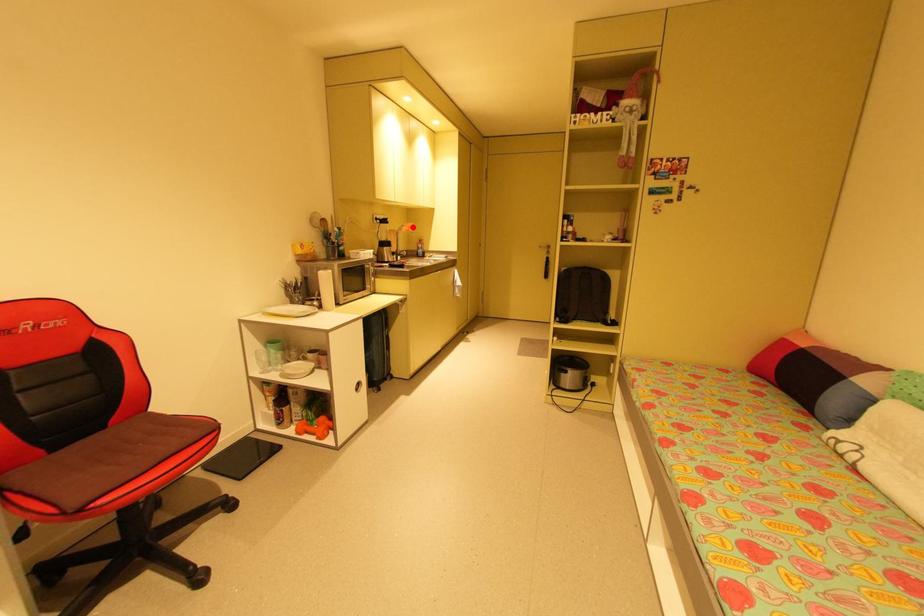
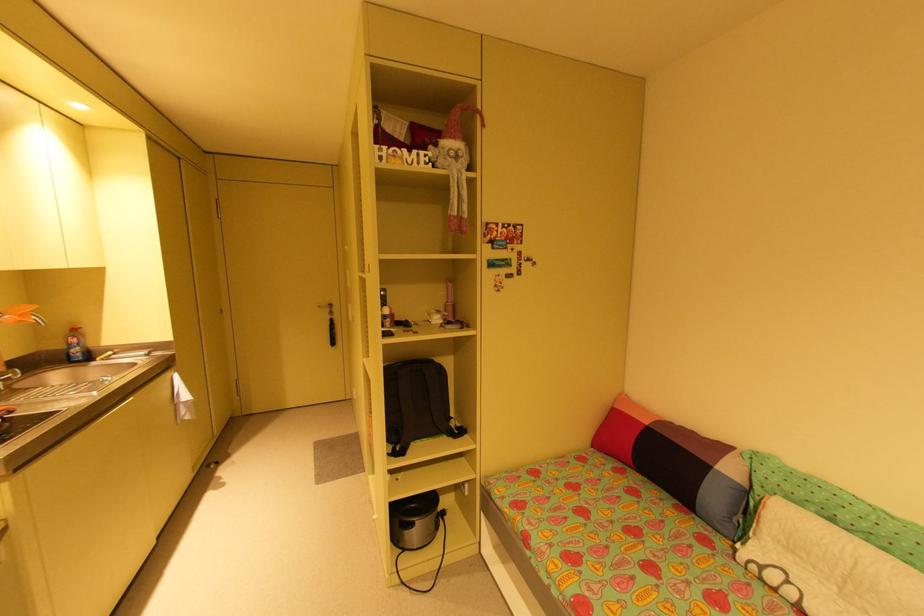
The point at the highlighted location is marked in the first image. Where is the corresponding point in the second image?

(25, 315)